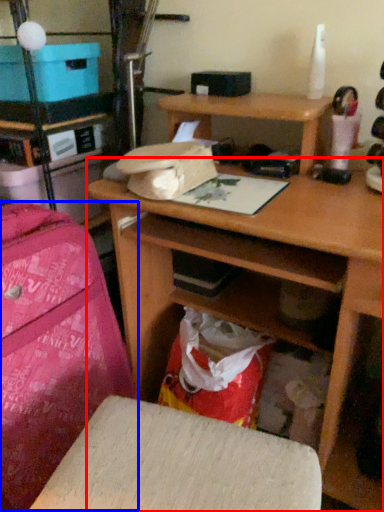
Question: Among these objects, which one is nearest to the camera, desk (highlighted by a red box) or luggage (highlighted by a blue box)?

Choices:
 (A) desk
 (B) luggage

Answer: (A)